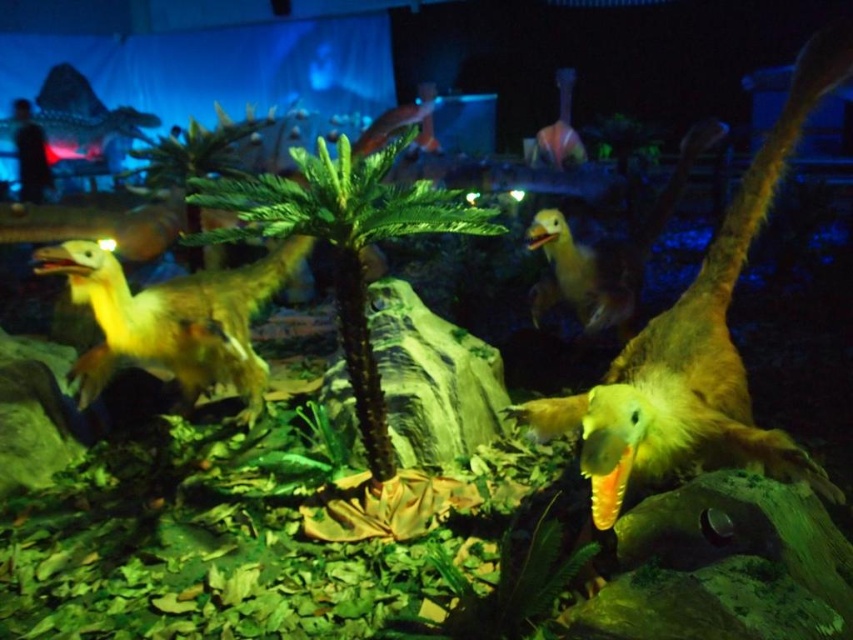
Question: Does yellow matte dinosaur at center appear under yellow matte duck at center?

Choices:
 (A) yes
 (B) no

Answer: (A)

Question: Does yellow matte dinosaur at center appear on the right side of green leafy palm tree at center?

Choices:
 (A) yes
 (B) no

Answer: (A)

Question: Which object is closer to the camera taking this photo?

Choices:
 (A) yellow matte duck at center
 (B) yellow matte dinosaur at center

Answer: (B)

Question: Where is green leafy palm tree at center located in relation to yellow matte dinosaur at left in the image?

Choices:
 (A) right
 (B) left

Answer: (A)

Question: Which is nearer to the yellow matte dinosaur at left?

Choices:
 (A) green leafy palm tree at center
 (B) yellow matte duck at center

Answer: (A)

Question: Which point is closer to the camera?

Choices:
 (A) yellow matte duck at center
 (B) yellow matte dinosaur at center
 (C) green leafy palm tree at center
 (D) yellow matte dinosaur at left

Answer: (B)